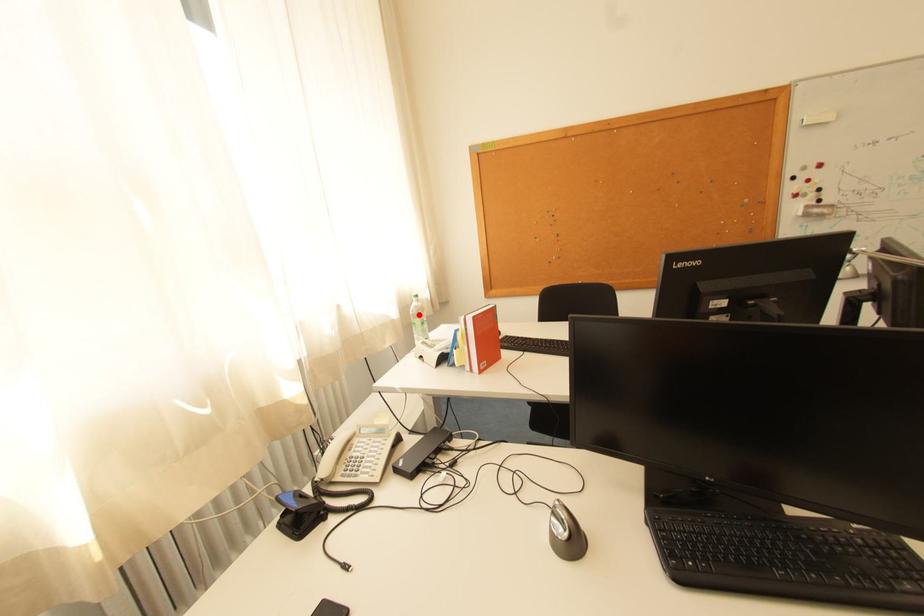
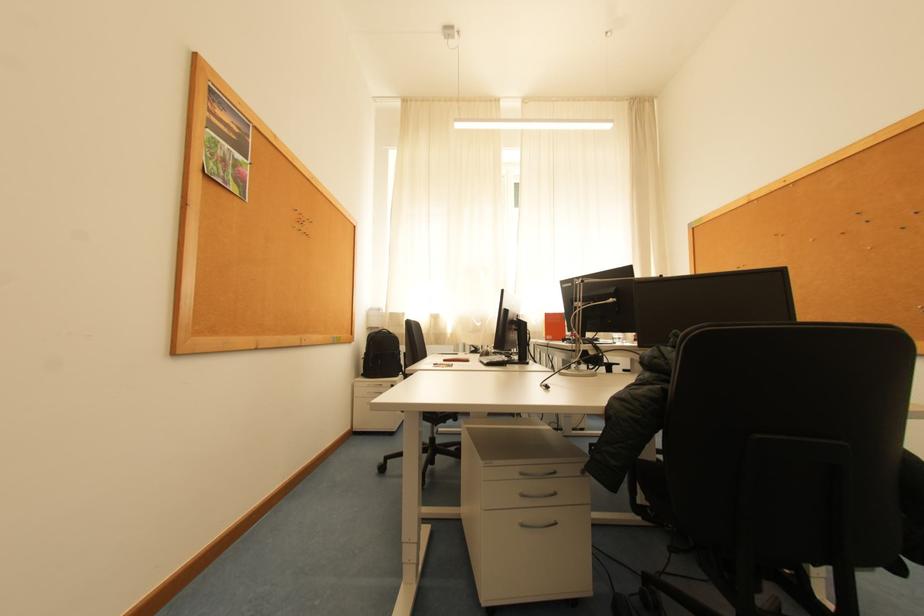
Question: I am providing you with two images of the same scene from different viewpoints. A red point is marked on the first image. Is the red point's position out of view in image 2?

Choices:
 (A) Yes
 (B) No

Answer: (A)